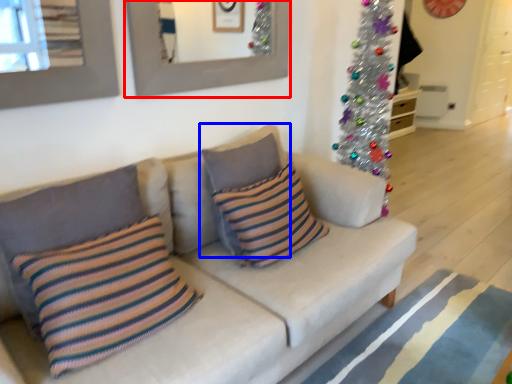
Question: Which of the following is the closest to the observer, picture frame (highlighted by a red box) or pillow (highlighted by a blue box)?

Choices:
 (A) picture frame
 (B) pillow

Answer: (B)